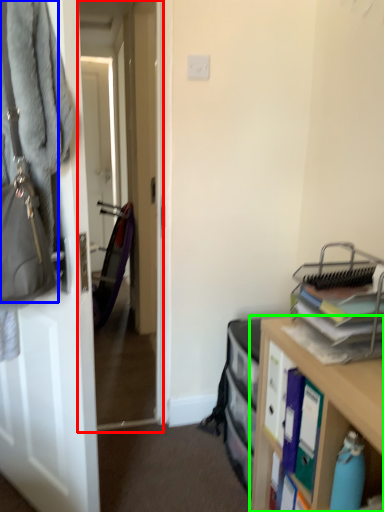
Question: Which object is the closest to the passage (highlighted by a red box)? Choose among these: handbag (highlighted by a blue box) or cabinetry (highlighted by a green box).

Choices:
 (A) handbag
 (B) cabinetry

Answer: (B)